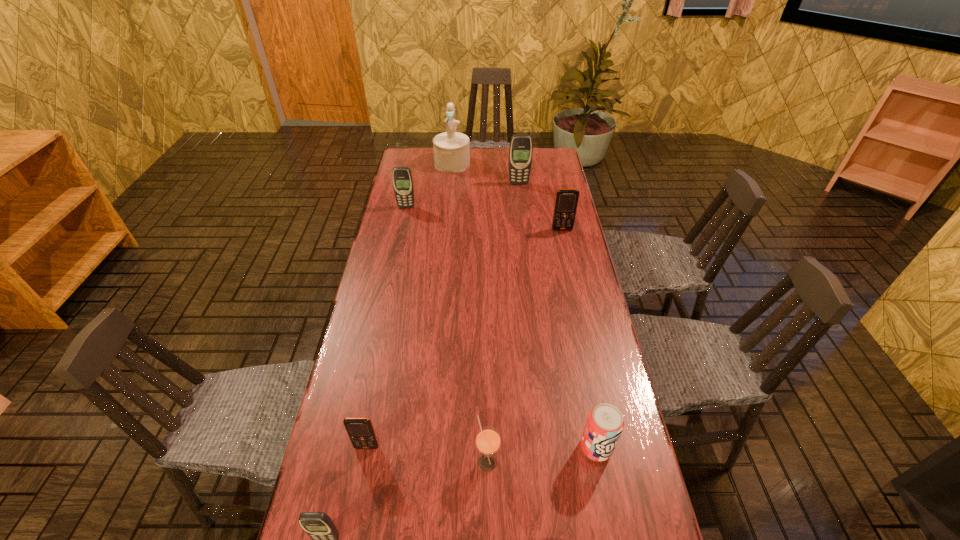
Find the location of a particular element. The height and width of the screenshot is (540, 960). vacant space in between the farthest gray cellular telephone and the farthest object is located at coordinates (486, 173).

Image resolution: width=960 pixels, height=540 pixels. Identify the location of free space between the white figurine and the bigger orange cellular telephone. (507, 197).

Identify the location of free space between the third farthest cellular telephone and the smaller orange cellular telephone. This screenshot has width=960, height=540. pos(465,338).

Find the location of a particular element. Image resolution: width=960 pixels, height=540 pixels. unoccupied position between the farthest object and the soda can is located at coordinates (524, 306).

Identify the location of the seventh closest object to the farthest gray cellular telephone. Image resolution: width=960 pixels, height=540 pixels. pos(318,526).

Find the location of a particular element. Image resolution: width=960 pixels, height=540 pixels. object that ranks as the fifth closest to the soda can is located at coordinates (402, 179).

Locate an element on the screen. the fourth closest cellular telephone to the second farthest cellular telephone is located at coordinates [x=318, y=526].

Select which cellular telephone is the third closest to the bigger orange cellular telephone. Please provide its 2D coordinates. Your answer should be formatted as a tuple, i.e. [(x, y)], where the tuple contains the x and y coordinates of a point satisfying the conditions above.

[(361, 432)]

Locate an element on the screen. Image resolution: width=960 pixels, height=540 pixels. gray cellular telephone that is the closest to the nearest gray cellular telephone is located at coordinates (402, 179).

Locate an element on the screen. The height and width of the screenshot is (540, 960). gray cellular telephone that is the second nearest to the fourth nearest cellular telephone is located at coordinates (318, 526).